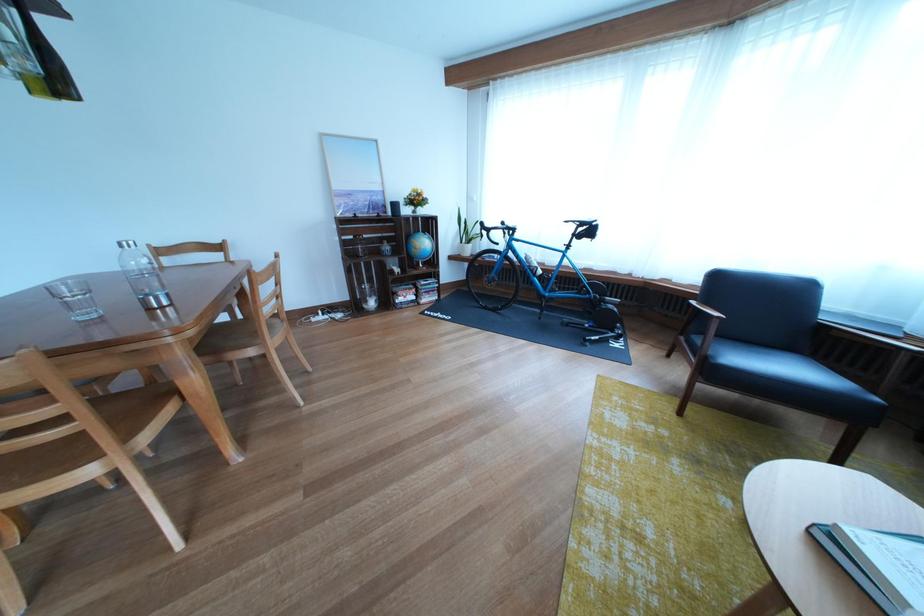
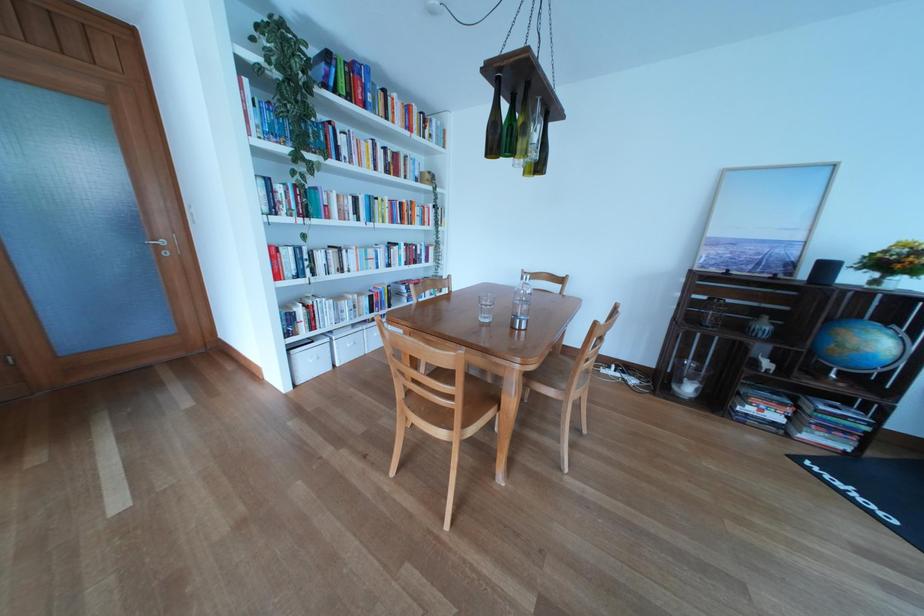
Locate, in the second image, the point that corresponds to (427,246) in the first image.

(855, 337)